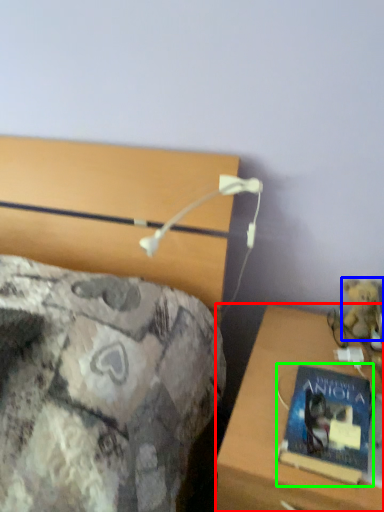
Question: Based on their relative distances, which object is farther from desk (highlighted by a red box)? Choose from teddy bear (highlighted by a blue box) and book (highlighted by a green box).

Choices:
 (A) teddy bear
 (B) book

Answer: (A)